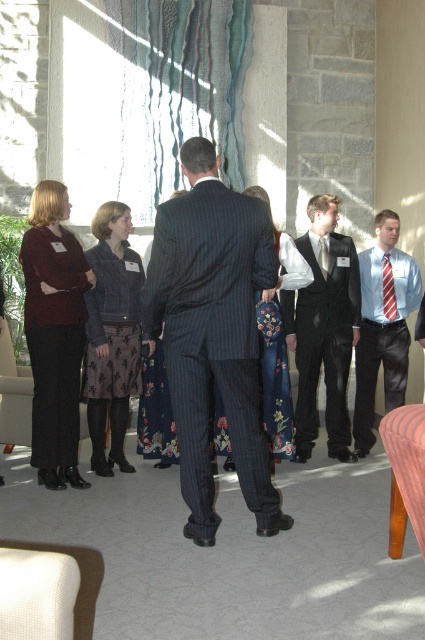
You are a photographer at the event and need to ensure both the light blue shirt with tie at center and the floral fabric dress at center are fully visible in your photo. Given their heights, which one might you need to adjust the camera angle for to capture both properly?

The light blue shirt with tie at center is taller than the floral fabric dress at center. To capture both properly, you might need to lower the camera angle slightly to ensure the taller light blue shirt with tie at center doesn

You are standing in the room and want to determine which of the two points, point (x=87, y=308) or point (x=382, y=282), is nearer to you. Based on the scene description, which point is closer?

Point (x=87, y=308) is closer to the camera than point (x=382, y=282), so the point (x=87, y=308) is nearer to you.

You are standing in the room and want to greet both the denim jacket at left and the light blue shirt with tie at center. Which one should you approach first if you want to greet the person closer to you?

You should greet the denim jacket at left first because it is closer to you than the light blue shirt with tie at center.